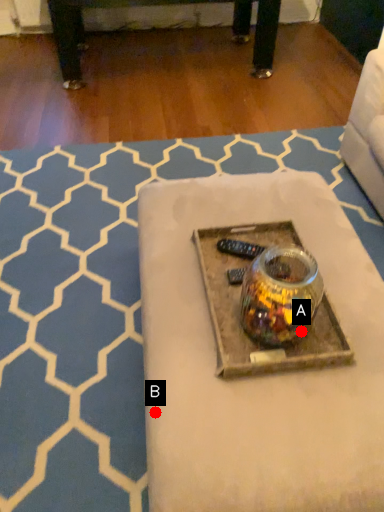
Question: Two points are circled on the image, labeled by A and B beside each circle. Which point is closer to the camera?

Choices:
 (A) A is closer
 (B) B is closer

Answer: (B)